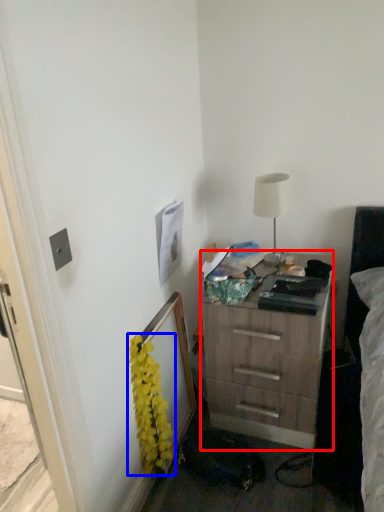
Question: Which of the following is the closest to the observer, chest of drawers (highlighted by a red box) or flower (highlighted by a blue box)?

Choices:
 (A) chest of drawers
 (B) flower

Answer: (B)